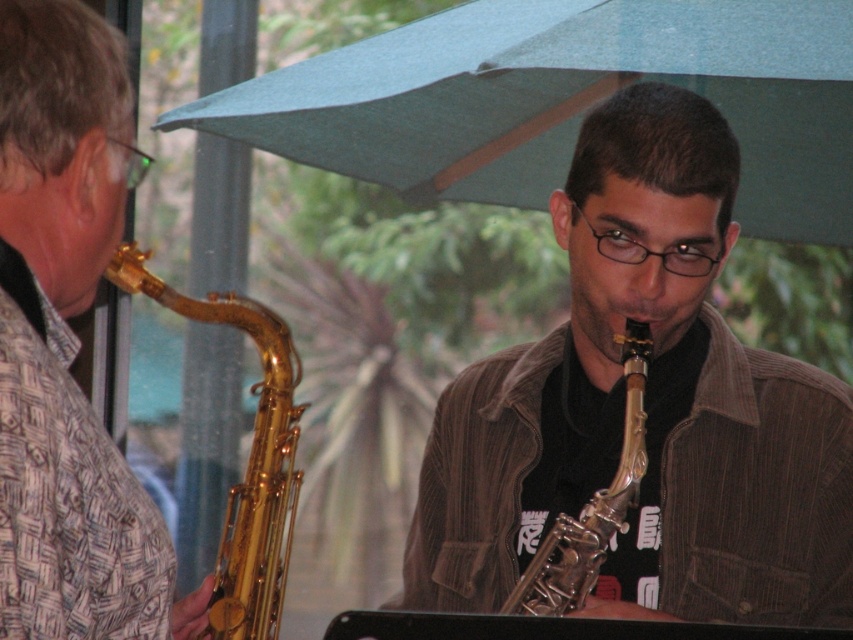
Between matte gold saxophone at left and gold polished saxophone at left, which one is positioned lower?

Positioned lower is gold polished saxophone at left.

Is matte gold saxophone at left wider than gold polished saxophone at left?

Incorrect, matte gold saxophone at left's width does not surpass gold polished saxophone at left's.

The width and height of the screenshot is (853, 640). In order to click on matte gold saxophone at left in this screenshot , I will do `click(67, 342)`.

Is green fabric umbrella at upper center shorter than gold polished saxophone at left?

Yes.

Based on the photo, does green fabric umbrella at upper center lie in front of gold polished saxophone at left?

No, green fabric umbrella at upper center is behind gold polished saxophone at left.

Locate an element on the screen. This screenshot has width=853, height=640. green fabric umbrella at upper center is located at coordinates (566, 100).

The height and width of the screenshot is (640, 853). In order to click on green fabric umbrella at upper center in this screenshot , I will do `click(566, 100)`.

From the picture: Does matte gold saxophone at left come behind gold shiny saxophone at center?

No, matte gold saxophone at left is closer to the viewer.

Measure the distance between matte gold saxophone at left and gold shiny saxophone at center.

matte gold saxophone at left and gold shiny saxophone at center are 46.71 centimeters apart.

Where is `matte gold saxophone at left`? matte gold saxophone at left is located at coordinates (67, 342).